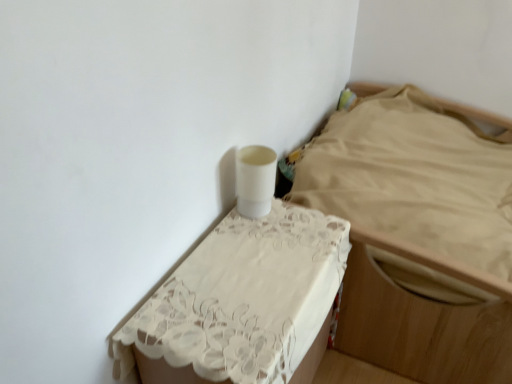
This screenshot has height=384, width=512. In order to click on empty space that is ontop of white lace tablecloth at upper center, positioned as the first furniture in left-to-right order in this screenshot , I will do `click(257, 270)`.